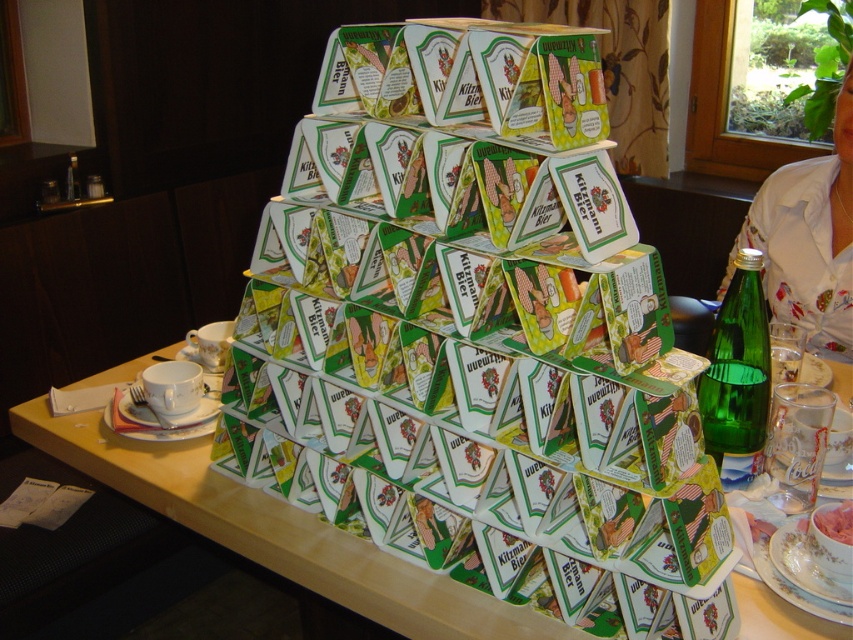
You are at the center of the pyramid structure made of boxes. You see a green cardboard triangle at point (274,531). What is the direction of the green cardboard triangle relative to your current position?

The green cardboard triangle at point (274,531) is located at the center of the pyramid structure, so it is directly in front of you.

You are standing at the point marked by the coordinates (473,372) in the image. What object are you directly at?

You are directly at the green cardboard house at center.